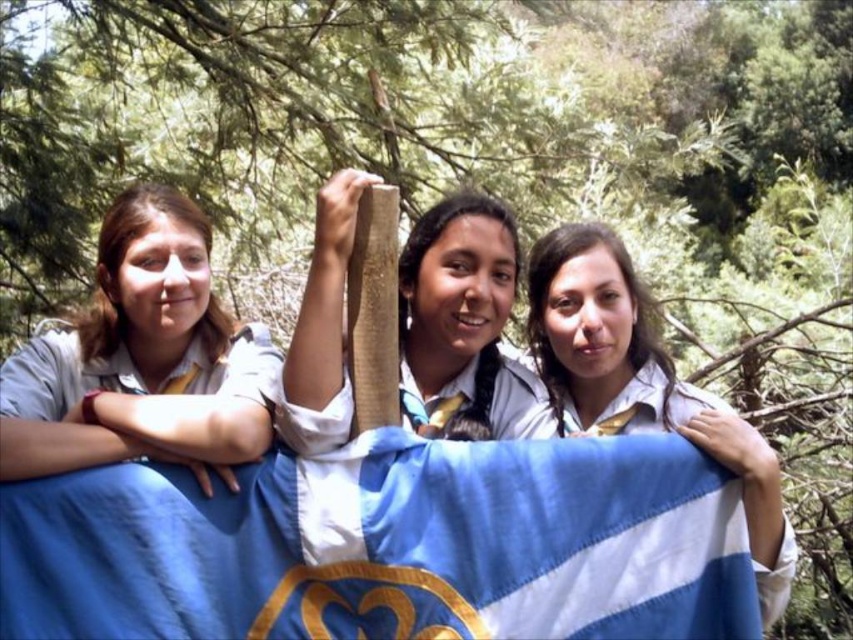
You are trying to locate the light brown shirt at left and the blue striped fabric at center in the image. Which object is positioned further to the left?

The light brown shirt at left is positioned to the left of the blue striped fabric at center, so the light brown shirt at left is further to the left.

You are standing at the camera position and want to hand a small gift to the group holding the blue fabric flag at center. Since you can only throw the gift 10 feet, will you be able to reach them?

The blue fabric flag at center is 8.80 feet away from the camera, so yes, you can throw the gift to them since the distance is within your 10 feet range.

You are a photographer trying to capture the scene of three scouts holding a flag in a forest. You notice the light brown shirt at left and the matte wooden stick at center. Which object is closer to the bottom of the photo?

The light brown shirt at left is positioned under the matte wooden stick at center, meaning it is closer to the bottom of the photo.